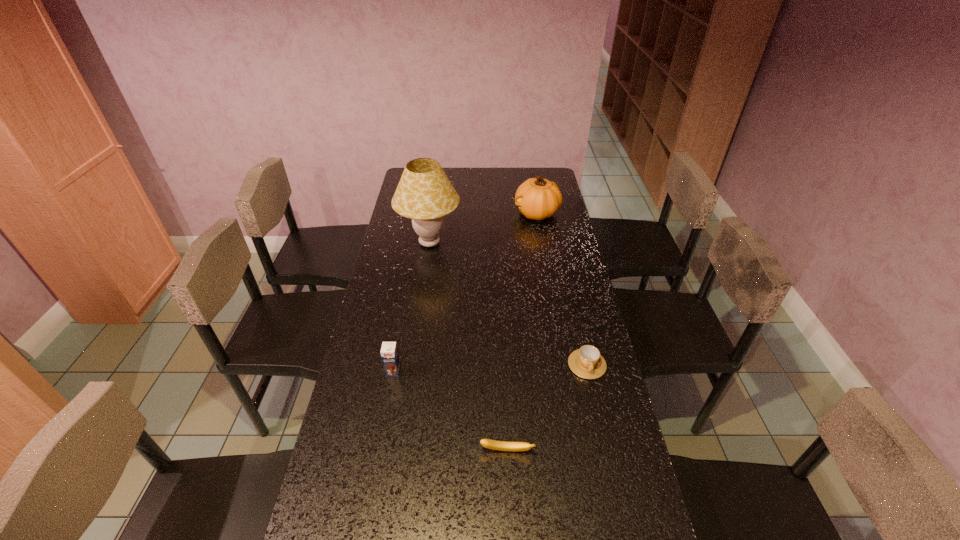
I want to click on blank space located on the front label of the chocolate milk, so click(386, 413).

The width and height of the screenshot is (960, 540). In order to click on vacant space located 0.160m with the handle on the side of the cup in this screenshot , I will do `click(602, 430)`.

Identify the location of vacant space located at the stem of the banana. The height and width of the screenshot is (540, 960). (509, 484).

Where is `lampshade located in the left edge section of the desktop`? The image size is (960, 540). lampshade located in the left edge section of the desktop is located at coordinates (424, 194).

Where is `chocolate milk present at the left edge`? This screenshot has width=960, height=540. chocolate milk present at the left edge is located at coordinates (389, 353).

Where is `pumpkin located at the right edge`? pumpkin located at the right edge is located at coordinates (537, 198).

This screenshot has height=540, width=960. Find the location of `cup that is positioned at the right edge`. cup that is positioned at the right edge is located at coordinates coord(586,362).

Find the location of a particular element. Image resolution: width=960 pixels, height=540 pixels. free space at the far edge of the desktop is located at coordinates (461, 179).

Locate an element on the screen. free location at the left edge is located at coordinates 407,319.

I want to click on vacant space at the right edge of the desktop, so click(565, 295).